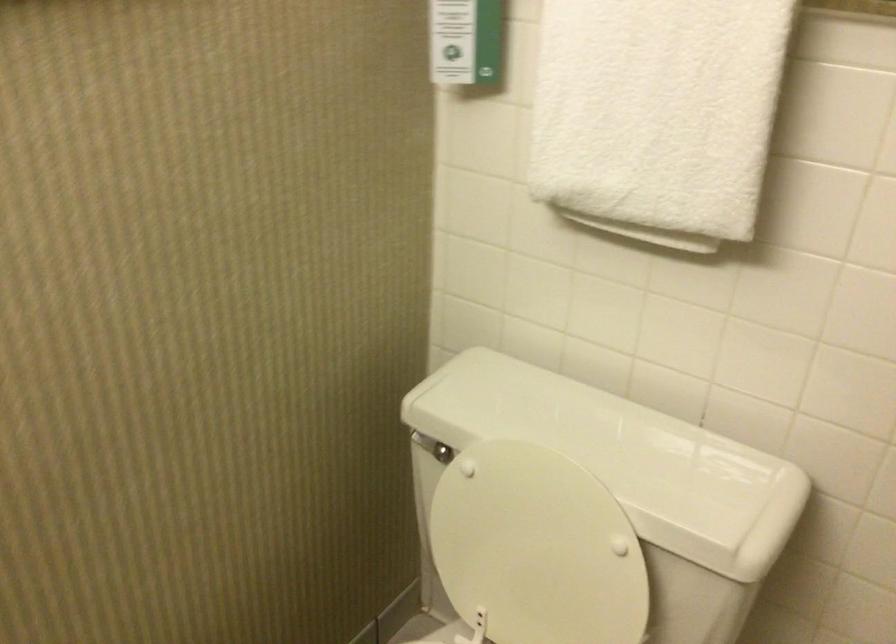
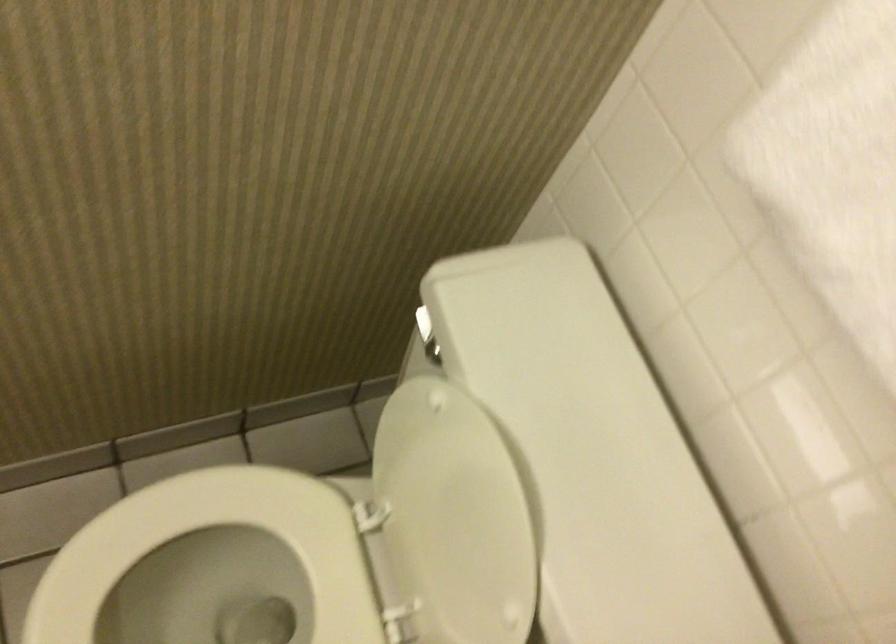
Find the pixel in the second image that matches (x=536, y=540) in the first image.

(453, 518)